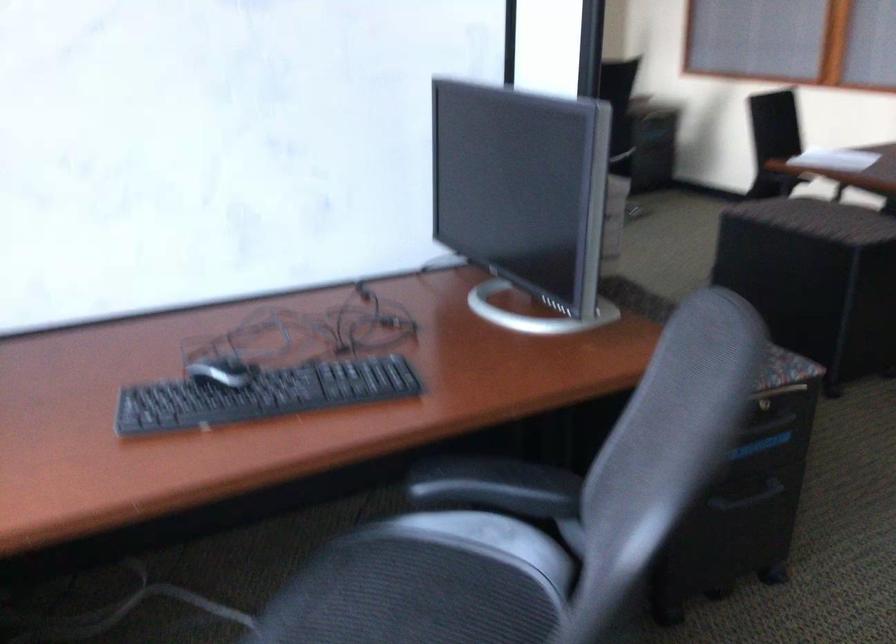
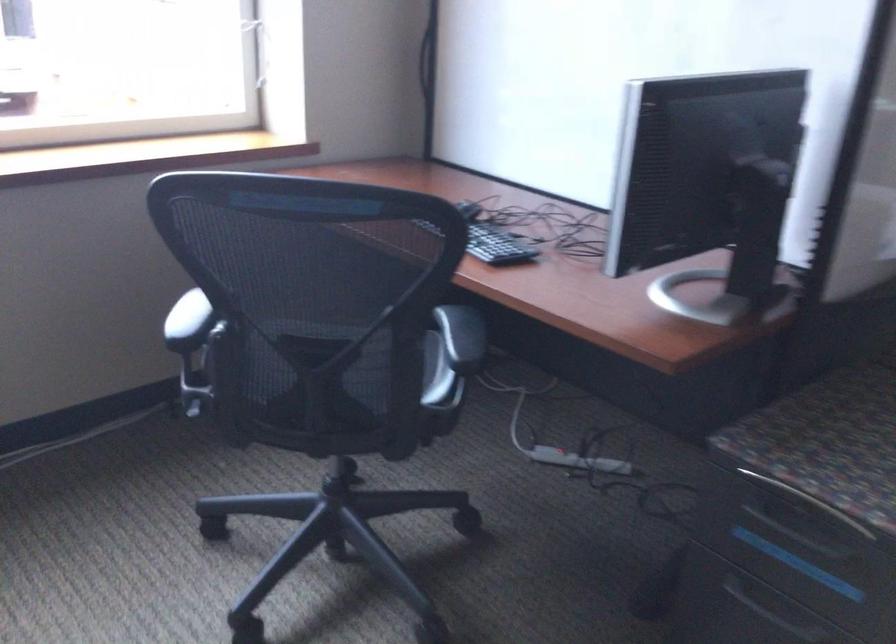
Question: I am providing you with two images of the same scene from different viewpoints. Which of the following objects are not visible in image2?

Choices:
 (A) red kettle handle
 (B) black keyboard
 (C) chair sitting surface
 (D) black chair armrest

Answer: (C)